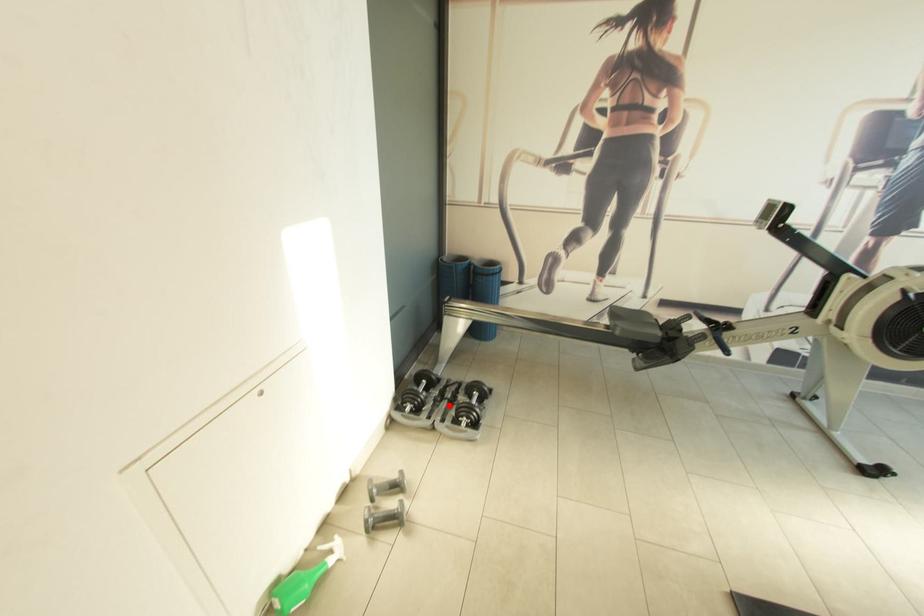
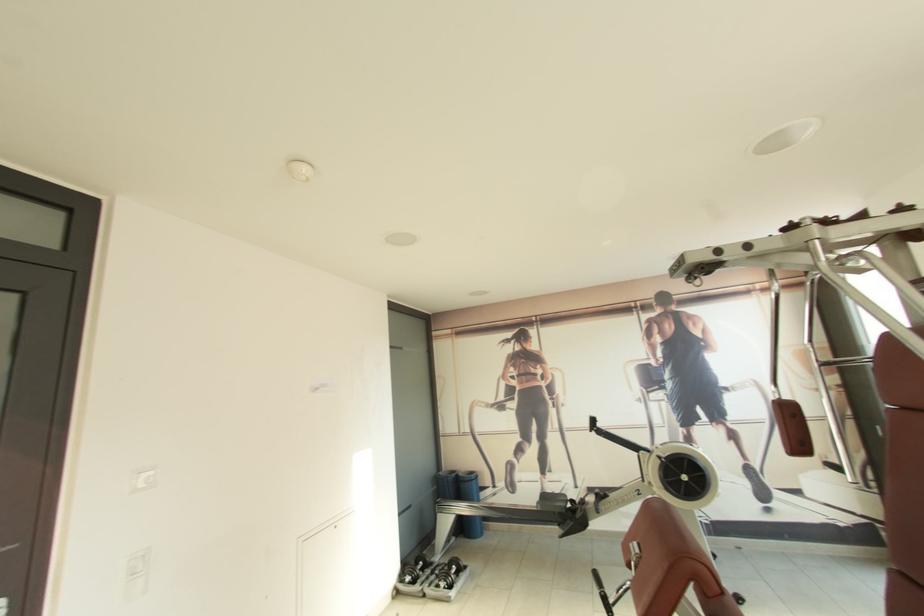
Question: I am providing you with two images of the same scene from different viewpoints. Image1 has a red point marked. In image2, the corresponding 3D location appears at what relative position? Reply with the corresponding letter.

Choices:
 (A) Closer
 (B) Farther

Answer: (A)